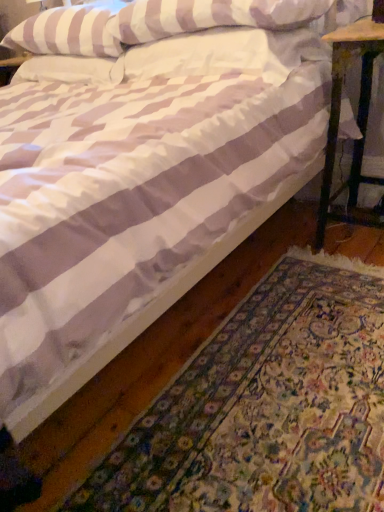
Question: From the image's perspective, does white striped pillow at upper center, which is the first pillow from right to left, appear higher than white textured rug at lower right?

Choices:
 (A) yes
 (B) no

Answer: (A)

Question: From a real-world perspective, is white striped pillow at upper center, placed as the 3th pillow when sorted from left to right, physically above white textured rug at lower right?

Choices:
 (A) yes
 (B) no

Answer: (A)

Question: Is white striped pillow at upper center, which is the first pillow from right to left, positioned behind white textured rug at lower right?

Choices:
 (A) yes
 (B) no

Answer: (A)

Question: Can you confirm if white striped pillow at upper center, which is the first pillow from right to left, is shorter than white textured rug at lower right?

Choices:
 (A) yes
 (B) no

Answer: (B)

Question: Is white striped pillow at upper center, placed as the 3th pillow when sorted from left to right, surrounding white textured rug at lower right?

Choices:
 (A) yes
 (B) no

Answer: (B)

Question: Considering the relative sizes of white striped pillow at upper center, which is the first pillow from right to left, and white textured rug at lower right in the image provided, is white striped pillow at upper center, which is the first pillow from right to left, smaller than white textured rug at lower right?

Choices:
 (A) yes
 (B) no

Answer: (A)

Question: Can you confirm if white striped pillow at upper center, placed as the 2th pillow when sorted from right to left, is smaller than white striped pillow at upper center, which is the first pillow from right to left?

Choices:
 (A) yes
 (B) no

Answer: (B)

Question: Is white striped pillow at upper center, placed as the 2th pillow when sorted from right to left, behind white striped pillow at upper center, which is the first pillow from right to left?

Choices:
 (A) yes
 (B) no

Answer: (B)

Question: Is white striped pillow at upper center, placed as the 2th pillow when sorted from right to left, taller than white striped pillow at upper center, which is the first pillow from right to left?

Choices:
 (A) no
 (B) yes

Answer: (B)

Question: Does white striped pillow at upper center, placed as the 2th pillow when sorted from right to left, have a lesser height compared to white striped pillow at upper center, placed as the 3th pillow when sorted from left to right?

Choices:
 (A) no
 (B) yes

Answer: (A)

Question: From a real-world perspective, is white striped pillow at upper center, placed as the 2th pillow when sorted from right to left, under white striped pillow at upper center, placed as the 3th pillow when sorted from left to right?

Choices:
 (A) yes
 (B) no

Answer: (B)

Question: Is white striped pillow at upper center, arranged as the 2th pillow when viewed from the left, positioned in front of white striped pillow at upper center, placed as the 3th pillow when sorted from left to right?

Choices:
 (A) yes
 (B) no

Answer: (A)

Question: Does wooden stool at right have a lesser width compared to white striped pillow at upper center, placed as the 2th pillow when sorted from right to left?

Choices:
 (A) no
 (B) yes

Answer: (B)